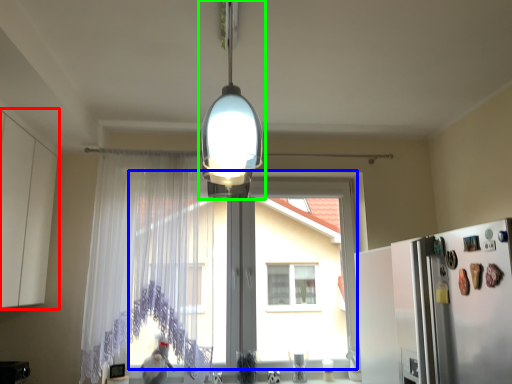
Question: Which is farther away from cabinetry (highlighted by a red box)? window screen (highlighted by a blue box) or lamp (highlighted by a green box)?

Choices:
 (A) window screen
 (B) lamp

Answer: (A)